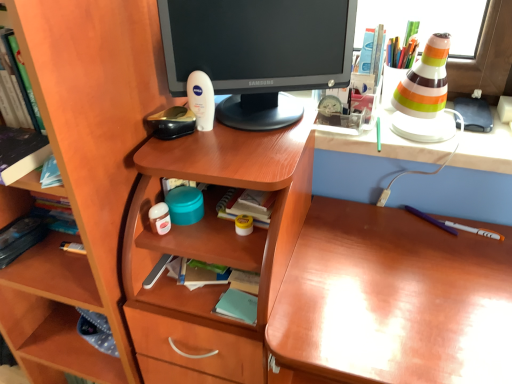
Identify the location of empty space that is ontop of glossy wood desk at center (from a real-world perspective). (404, 321).